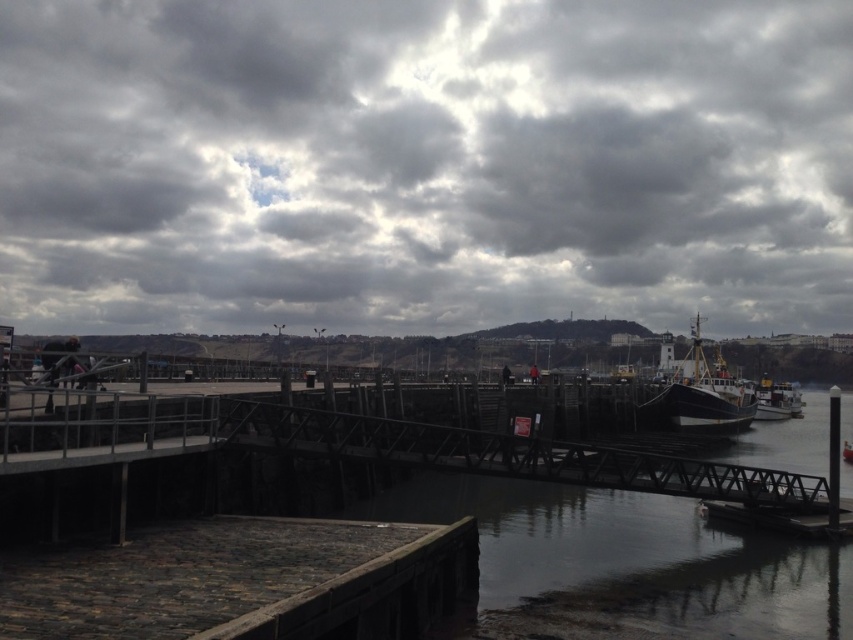
Does stone cobblestone dock at lower left have a larger size compared to wooden ship at right?

No.

Is point (325, 589) behind point (689, 387)?

No, it is not.

The width and height of the screenshot is (853, 640). Identify the location of stone cobblestone dock at lower left. (247, 582).

Does point (256, 22) come farther from viewer compared to point (22, 627)?

That is True.

Who is more forward, [374,13] or [206,637]?

Point [206,637] is in front.

Locate an element on the screen. This screenshot has height=640, width=853. cloudy sky at upper center is located at coordinates (x=424, y=163).

At what (x,y) coordinates should I click in order to perform the action: click on cloudy sky at upper center. Please return your answer as a coordinate pair (x, y). Looking at the image, I should click on (424, 163).

Can you confirm if cloudy sky at upper center is positioned below wooden ship at right?

Actually, cloudy sky at upper center is above wooden ship at right.

Who is more distant from viewer, (776, 314) or (712, 413)?

The point (776, 314) is more distant.

Identify the location of cloudy sky at upper center. The image size is (853, 640). click(x=424, y=163).